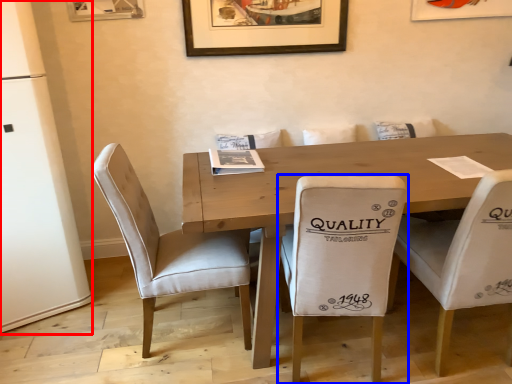
Question: Which object is further to the camera taking this photo, fridge (highlighted by a red box) or chair (highlighted by a blue box)?

Choices:
 (A) fridge
 (B) chair

Answer: (A)